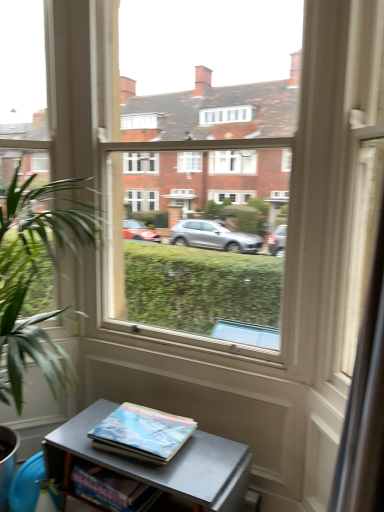
Question: Is point (132, 408) positioned closer to the camera than point (125, 498)?

Choices:
 (A) farther
 (B) closer

Answer: (A)

Question: Is hardcover book at center, marked as the 1th book in a top-to-bottom arrangement, inside or outside of hardcover book at lower center, the 2th book from the top?

Choices:
 (A) outside
 (B) inside

Answer: (A)

Question: Based on their relative distances, which object is farther from the green leafy plant at left?

Choices:
 (A) hardcover book at lower center, which appears as the 1th book when ordered from the bottom
 (B) hardcover book at center, the second book ordered from the bottom
 (C) metallic gray table at lower center
 (D) transparent glass door at center

Answer: (D)

Question: Which object is positioned farthest from the green leafy plant at left?

Choices:
 (A) hardcover book at lower center, the 2th book from the top
 (B) metallic gray table at lower center
 (C) transparent glass door at center
 (D) hardcover book at center, marked as the 1th book in a top-to-bottom arrangement

Answer: (C)